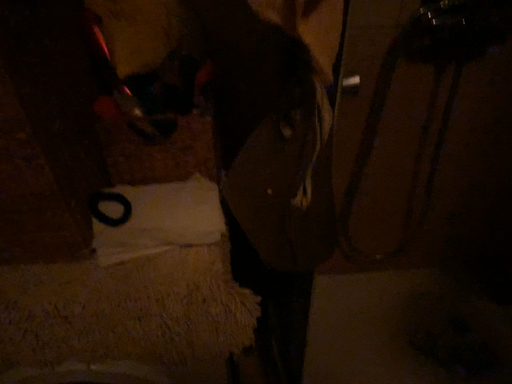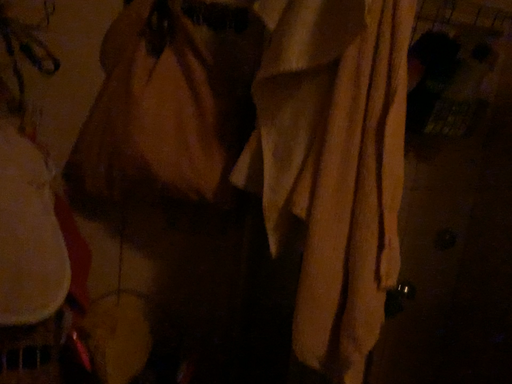
Question: How did the camera likely rotate when shooting the video?

Choices:
 (A) rotated right
 (B) rotated left

Answer: (A)